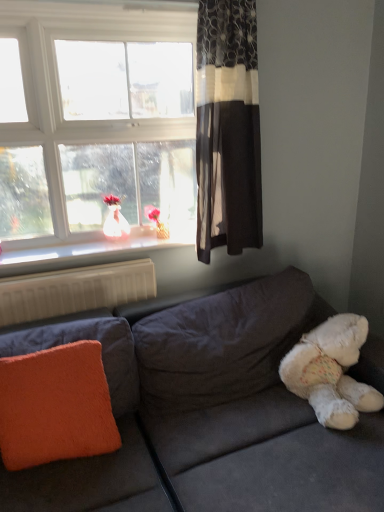
You are a GUI agent. You are given a task and a screenshot of the screen. Output one action in this format:
    pyautogui.click(x=<x>, y=<y>)
    Task: Click on the empty space that is ontop of clear glass window at upper left
    This screenshot has height=512, width=384.
    Given the screenshot: What is the action you would take?
    pyautogui.click(x=100, y=3)